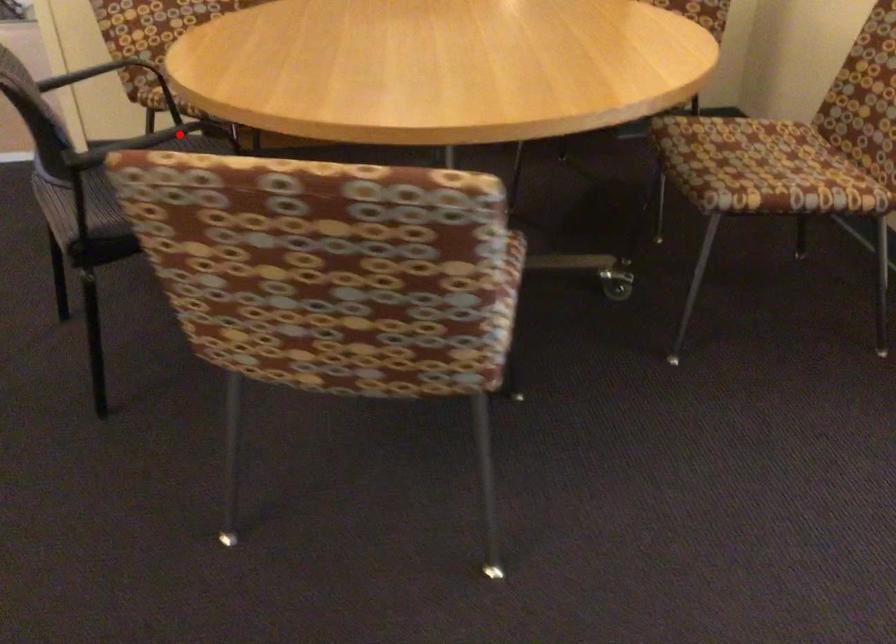
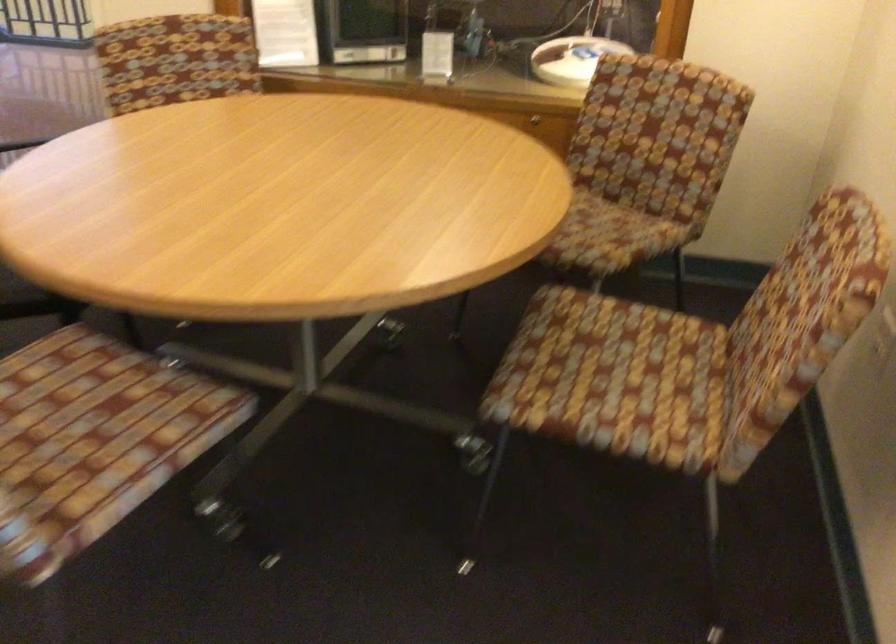
Question: I am providing you with two images of the same scene from different viewpoints. A red point is marked on the first image. At the location where the point appears in image 1, is it still visible in image 2?

Choices:
 (A) Yes
 (B) No

Answer: (B)